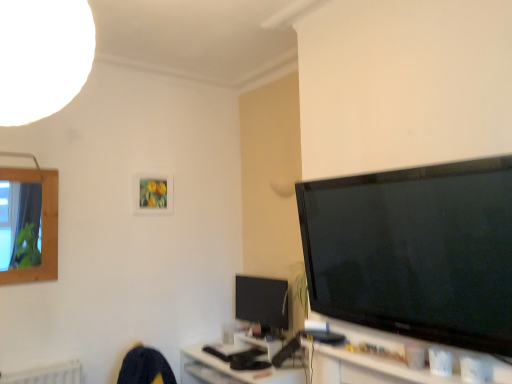
Question: Is white glossy tv cabinet at lower right taller than matte wooden picture frame at upper center?

Choices:
 (A) no
 (B) yes

Answer: (A)

Question: Is white glossy tv cabinet at lower right at the right side of matte wooden picture frame at upper center?

Choices:
 (A) no
 (B) yes

Answer: (B)

Question: Would you consider white glossy tv cabinet at lower right to be distant from matte wooden picture frame at upper center?

Choices:
 (A) no
 (B) yes

Answer: (B)

Question: Considering the relative sizes of white glossy tv cabinet at lower right and matte wooden picture frame at upper center in the image provided, is white glossy tv cabinet at lower right bigger than matte wooden picture frame at upper center?

Choices:
 (A) no
 (B) yes

Answer: (B)

Question: From the image's perspective, is white glossy tv cabinet at lower right beneath matte wooden picture frame at upper center?

Choices:
 (A) yes
 (B) no

Answer: (A)

Question: Is white glossy tv cabinet at lower right further to camera compared to matte wooden picture frame at upper center?

Choices:
 (A) yes
 (B) no

Answer: (B)

Question: Can you confirm if matte wooden picture frame at upper center is taller than wooden frame at left?

Choices:
 (A) no
 (B) yes

Answer: (A)

Question: Is matte wooden picture frame at upper center facing away from wooden frame at left?

Choices:
 (A) no
 (B) yes

Answer: (A)

Question: Considering the relative sizes of matte wooden picture frame at upper center and wooden frame at left in the image provided, is matte wooden picture frame at upper center thinner than wooden frame at left?

Choices:
 (A) yes
 (B) no

Answer: (A)

Question: Is the depth of matte wooden picture frame at upper center greater than that of wooden frame at left?

Choices:
 (A) no
 (B) yes

Answer: (B)

Question: From a real-world perspective, is matte wooden picture frame at upper center beneath wooden frame at left?

Choices:
 (A) yes
 (B) no

Answer: (B)

Question: Is matte wooden picture frame at upper center far from wooden frame at left?

Choices:
 (A) yes
 (B) no

Answer: (B)

Question: Could you tell me if black matte keyboard at lower center is facing white glossy tv cabinet at lower right?

Choices:
 (A) yes
 (B) no

Answer: (B)